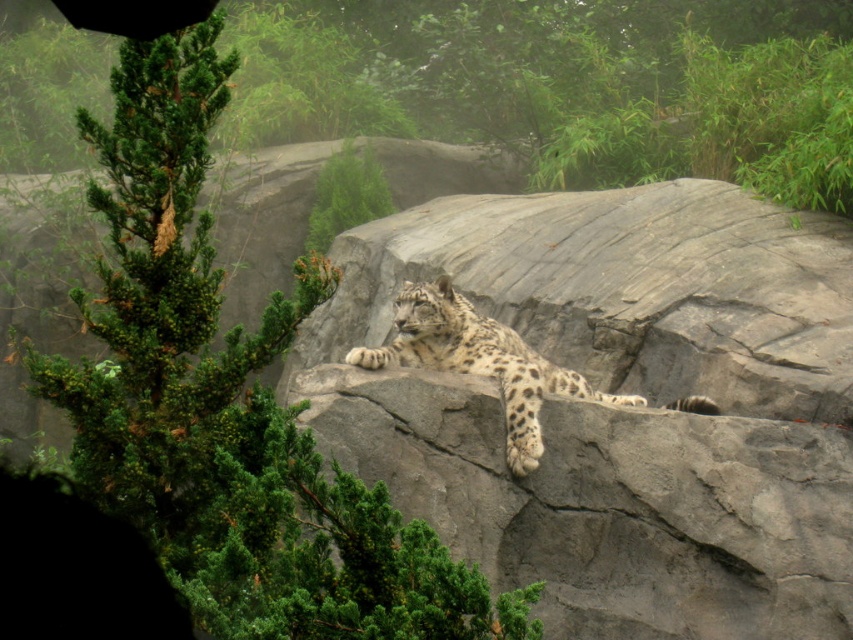
Does point (404, 433) come closer to viewer compared to point (367, 554)?

No.

Which is below, gray rough rock at center or green textured pine tree at upper left?

Positioned lower is gray rough rock at center.

Is point (788, 451) positioned in front of point (347, 604)?

No, (788, 451) is behind (347, 604).

Identify the location of gray rough rock at center. (618, 408).

Identify the location of gray rough rock at center. This screenshot has height=640, width=853. (618, 408).

Between gray rough rock at center and spotted fur snow leopard at center, which one is positioned lower?

gray rough rock at center is below.

Find the location of a particular element. gray rough rock at center is located at coordinates (618, 408).

Does green textured pine tree at upper left come behind spotted fur snow leopard at center?

No, green textured pine tree at upper left is in front of spotted fur snow leopard at center.

Between green textured pine tree at upper left and spotted fur snow leopard at center, which one has less height?

spotted fur snow leopard at center

Who is more distant from viewer, (277, 584) or (695, 403)?

Point (695, 403)

I want to click on green textured pine tree at upper left, so click(x=231, y=404).